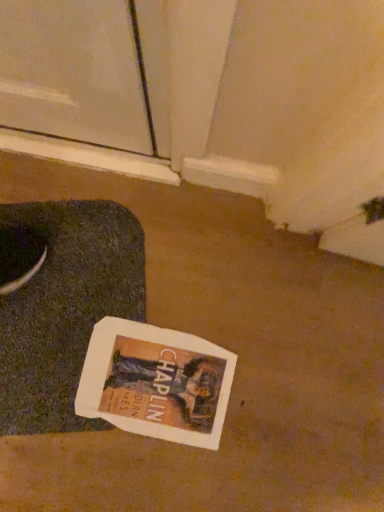
Question: Is white paper magazine at center taller or shorter than dark gray textured yoga mat at lower left?

Choices:
 (A) tall
 (B) short

Answer: (B)

Question: Based on their sizes in the image, would you say white paper magazine at center is bigger or smaller than dark gray textured yoga mat at lower left?

Choices:
 (A) small
 (B) big

Answer: (A)

Question: Considering the positions of white paper magazine at center and dark gray textured yoga mat at lower left in the image, is white paper magazine at center wider or thinner than dark gray textured yoga mat at lower left?

Choices:
 (A) wide
 (B) thin

Answer: (B)

Question: In terms of width, does dark gray textured yoga mat at lower left look wider or thinner when compared to white paper magazine at center?

Choices:
 (A) thin
 (B) wide

Answer: (B)

Question: Is point (16, 206) positioned closer to the camera than point (185, 372)?

Choices:
 (A) farther
 (B) closer

Answer: (A)

Question: Looking at the image, does dark gray textured yoga mat at lower left seem bigger or smaller compared to white paper magazine at center?

Choices:
 (A) big
 (B) small

Answer: (A)

Question: From the image's perspective, is dark gray textured yoga mat at lower left located above or below white paper magazine at center?

Choices:
 (A) below
 (B) above

Answer: (B)